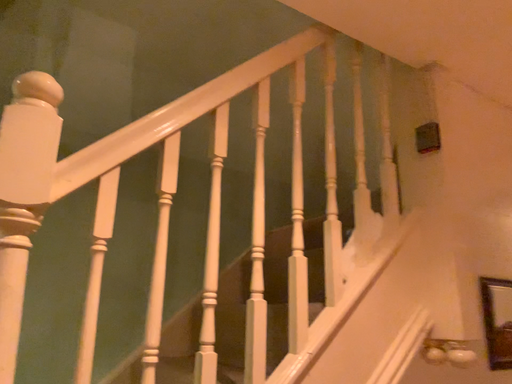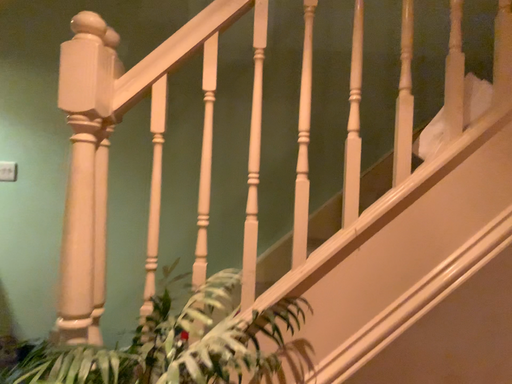
Question: Which way did the camera rotate in the video?

Choices:
 (A) rotated left
 (B) rotated right

Answer: (A)